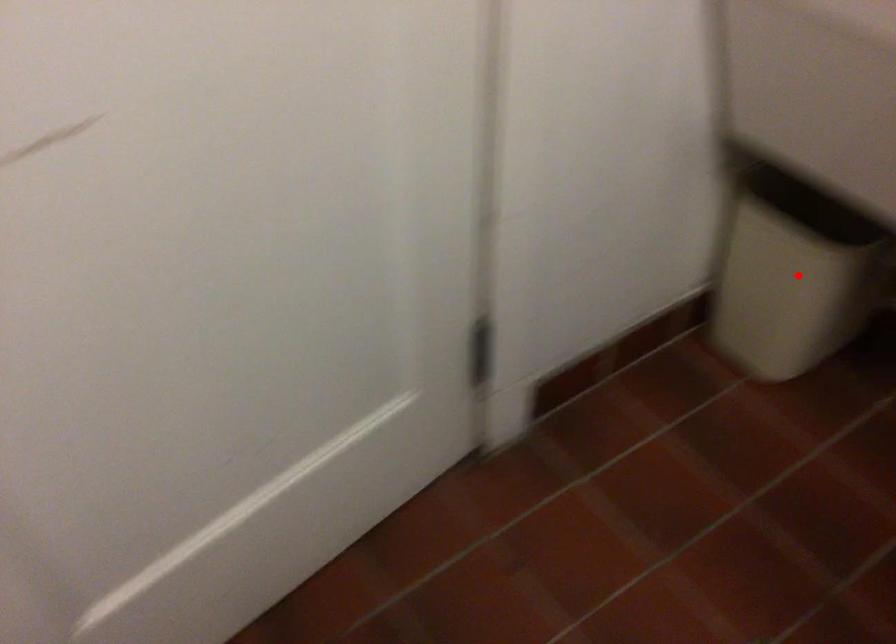
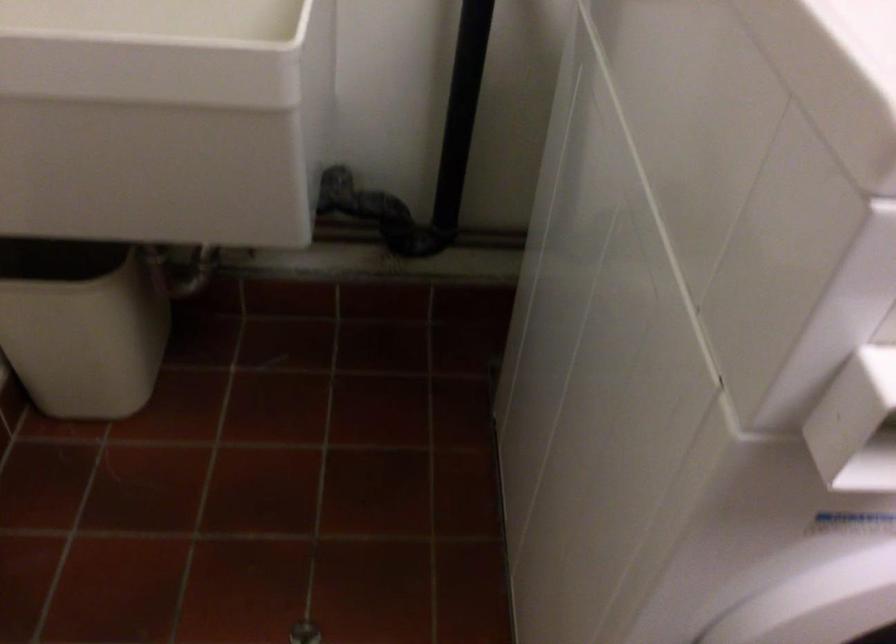
The point at the highlighted location is marked in the first image. Where is the corresponding point in the second image?

(82, 325)